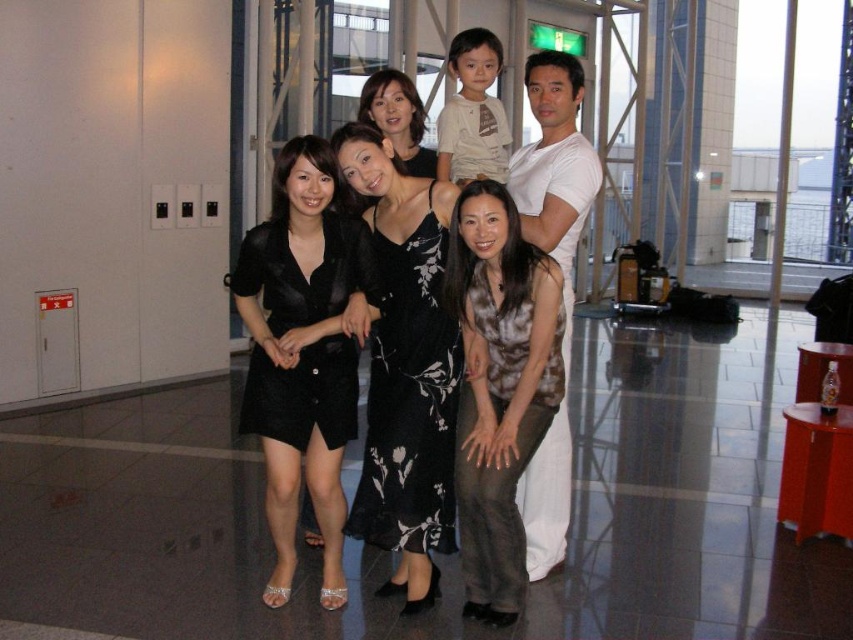
How much distance is there between brown textured top at center and black satin dress at center?

brown textured top at center and black satin dress at center are 24.41 inches apart.

Which is below, brown textured top at center or black satin dress at center?

brown textured top at center is lower down.

The width and height of the screenshot is (853, 640). I want to click on brown textured top at center, so click(x=498, y=387).

Who is more distant from viewer, (x=306, y=392) or (x=575, y=150)?

The point (x=575, y=150) is behind.

Can you confirm if black satin dress at center is positioned to the left of white cotton shirt at right?

Yes, black satin dress at center is to the left of white cotton shirt at right.

Is point (293, 413) positioned in front of point (532, 164)?

Yes, it is in front of point (532, 164).

Find the location of `black satin dress at center`. black satin dress at center is located at coordinates (302, 273).

Who is taller, black satin dress at center or black floral dress at center?

Standing taller between the two is black satin dress at center.

Who is lower down, black satin dress at center or black floral dress at center?

black satin dress at center is lower down.

Is point (352, 355) closer to camera compared to point (421, 134)?

Yes, point (352, 355) is closer to viewer.

Where is `black satin dress at center`? Image resolution: width=853 pixels, height=640 pixels. black satin dress at center is located at coordinates (302, 273).